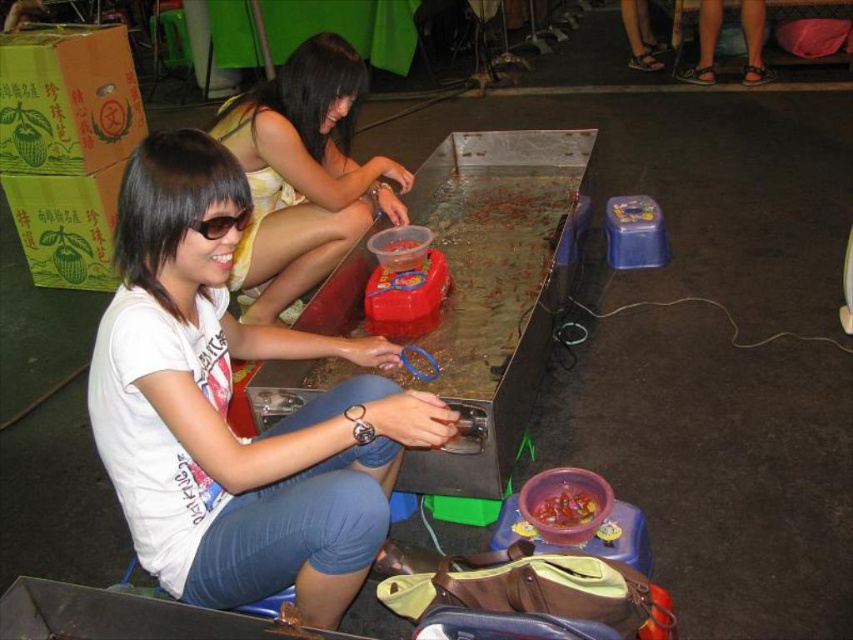
Question: Does translucent plastic bowl at lower center appear on the left side of black plastic goggles at left?

Choices:
 (A) no
 (B) yes

Answer: (A)

Question: Is translucent plastic bowl at lower center above translucent plastic bucket at center?

Choices:
 (A) no
 (B) yes

Answer: (A)

Question: Which of these objects is positioned closest to the yellow fabric dress at center?

Choices:
 (A) translucent plastic bucket at center
 (B) white matte shirt at center
 (C) black plastic goggles at left

Answer: (A)

Question: Which is nearer to the yellow fabric dress at center?

Choices:
 (A) white matte shirt at center
 (B) black plastic goggles at left
 (C) translucent plastic bowl at lower center

Answer: (A)

Question: Can you confirm if white matte shirt at center is thinner than translucent plastic bucket at center?

Choices:
 (A) no
 (B) yes

Answer: (A)

Question: Based on their relative distances, which object is farther from the translucent plastic bowl at lower center?

Choices:
 (A) white matte shirt at center
 (B) black plastic goggles at left
 (C) yellow fabric dress at center

Answer: (C)